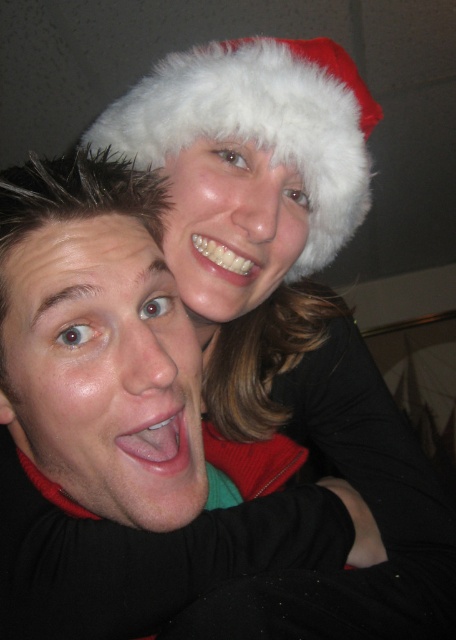
Can you confirm if matte black shirt at center is positioned below white fluffy santa hat at upper center?

Yes, matte black shirt at center is below white fluffy santa hat at upper center.

How far apart are matte black shirt at center and white fluffy santa hat at upper center?

The distance of matte black shirt at center from white fluffy santa hat at upper center is 6.67 inches.

Does point (166, 400) come in front of point (130, 116)?

That is True.

The height and width of the screenshot is (640, 456). Identify the location of matte black shirt at center. (115, 417).